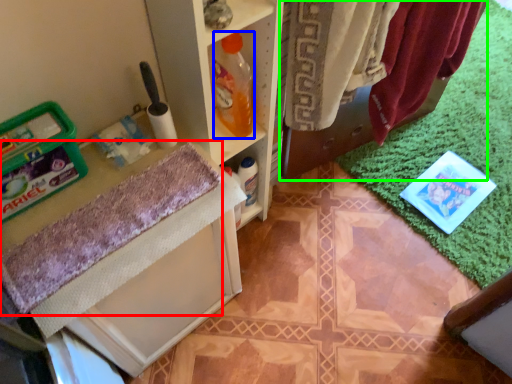
Question: Which object is the farthest from bath towel (highlighted by a red box)? Choose among these: bottle (highlighted by a blue box) or laundry (highlighted by a green box).

Choices:
 (A) bottle
 (B) laundry

Answer: (B)